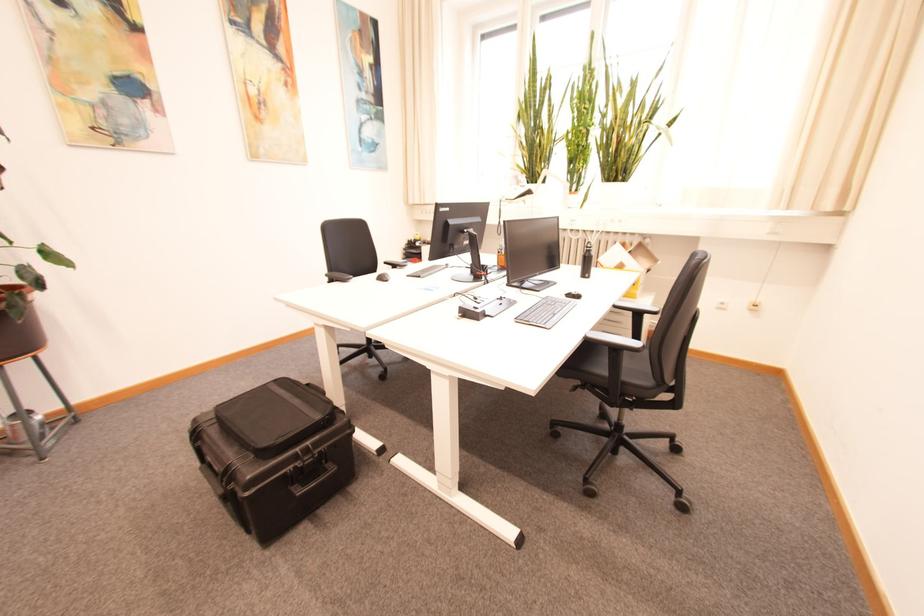
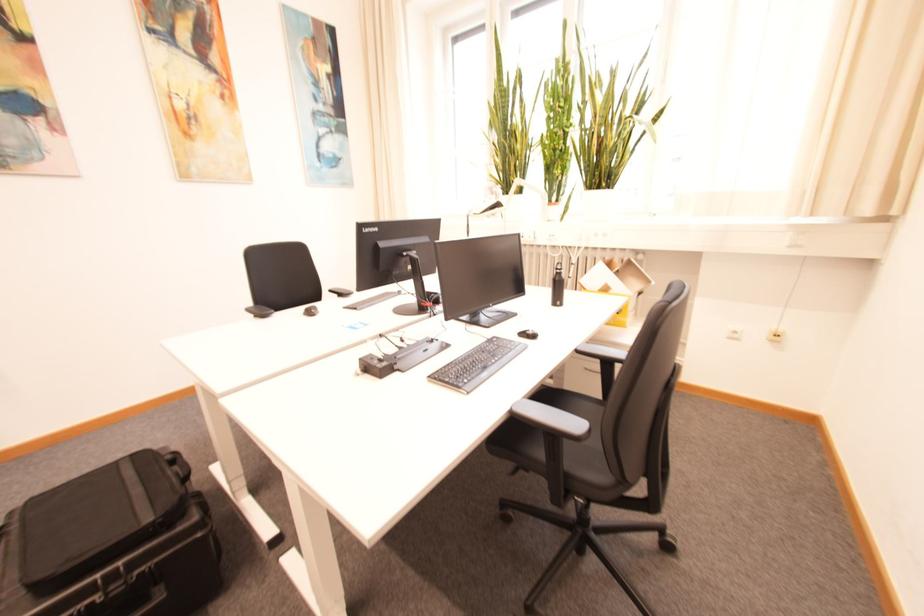
Question: The camera is either moving clockwise (left) or counter-clockwise (right) around the object. The first image is from the beginning of the video and the second image is from the end. Is the camera moving left or right when shooting the video?

Choices:
 (A) Left
 (B) Right

Answer: (B)